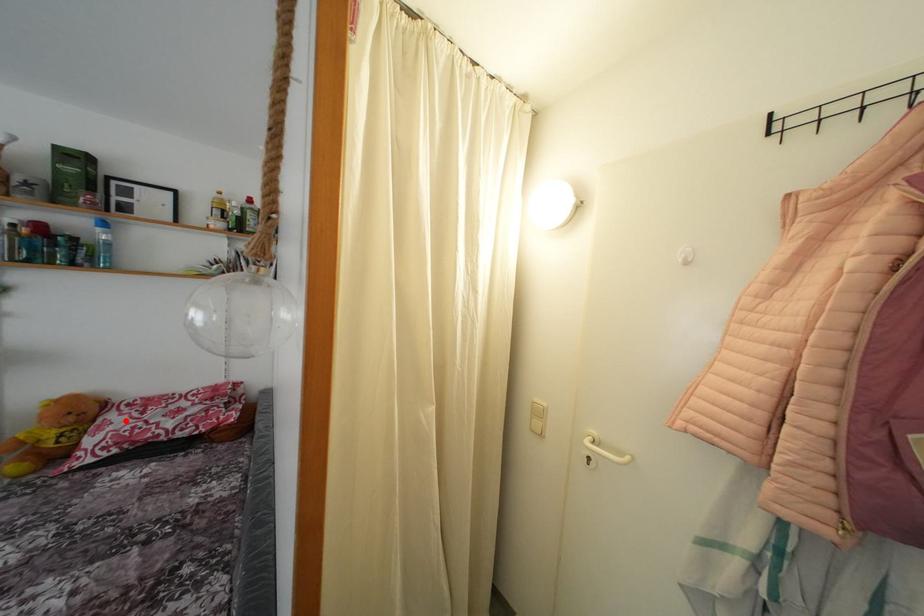
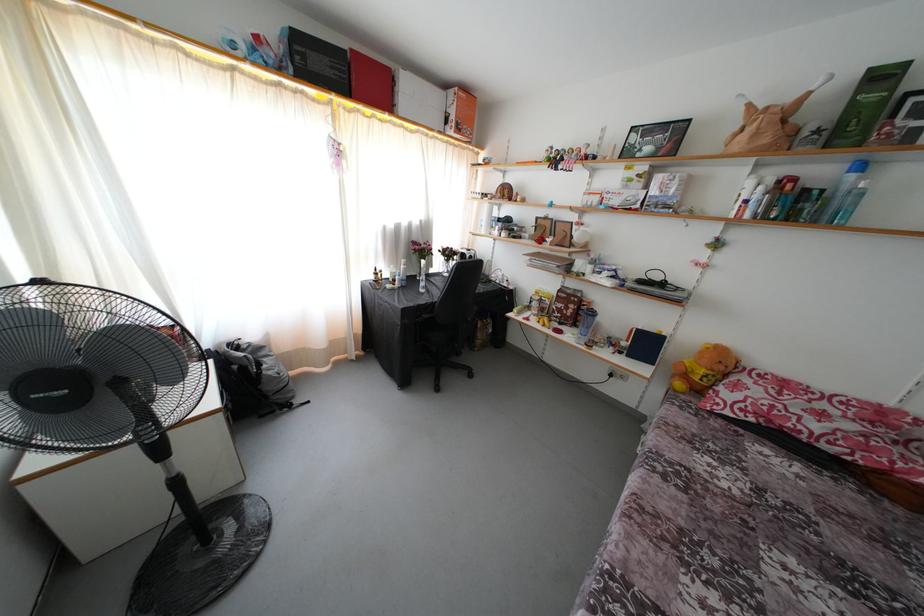
In the second image, find the point that corresponds to the highlighted location in the first image.

(760, 389)